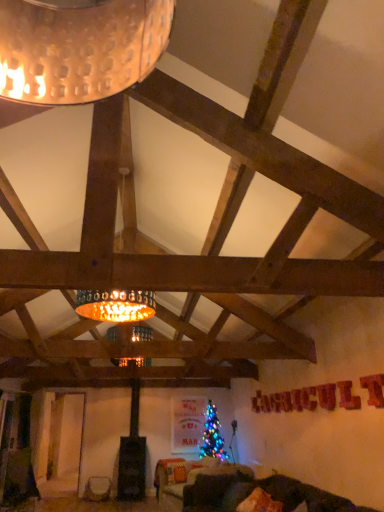
Find the location of a particular element. This screenshot has height=512, width=384. velvet dark green couch at lower center is located at coordinates (264, 490).

The height and width of the screenshot is (512, 384). I want to click on velvet dark green couch at lower center, so click(264, 490).

Which of these two, velvet orange pillow at lower center or matte white vase at lower left, is bigger?

With larger size is matte white vase at lower left.

The width and height of the screenshot is (384, 512). Identify the location of furniture behind the velvet orange pillow at lower center. (97, 489).

Considering the sizes of velvet orange pillow at lower center and matte white vase at lower left in the image, is velvet orange pillow at lower center wider or thinner than matte white vase at lower left?

Clearly, velvet orange pillow at lower center has less width compared to matte white vase at lower left.

Between velvet orange pillow at lower center and matte white vase at lower left, which one has less height?

velvet orange pillow at lower center is shorter.

What's the angular difference between velvet orange pillow at lower center and velvet dark green couch at lower center's facing directions?

1.31 degrees.

Looking at this image, from a real-world perspective, between velvet orange pillow at lower center and velvet dark green couch at lower center, who is vertically higher?

In real-world perspective, velvet orange pillow at lower center is above.

I want to click on couch that is on the left side of velvet orange pillow at lower center, so click(x=264, y=490).

Which is correct: velvet orange pillow at lower center is inside velvet dark green couch at lower center, or outside of it?

velvet orange pillow at lower center is spatially positioned inside velvet dark green couch at lower center.

Does point (204, 480) appear closer or farther from the camera than point (250, 495)?

Point (204, 480) is farther from the camera than point (250, 495).

Between velvet dark green couch at lower center and velvet orange pillow at lower center, which one has larger size?

velvet dark green couch at lower center is bigger.

From a real-world perspective, is velvet dark green couch at lower center physically below velvet orange pillow at lower center?

Yes, from a real-world perspective, velvet dark green couch at lower center is under velvet orange pillow at lower center.

From the image's perspective, is velvet dark green couch at lower center located above or below matte white vase at lower left?

From the image's perspective, velvet dark green couch at lower center appears above matte white vase at lower left.

Is velvet dark green couch at lower center to the left or to the right of matte white vase at lower left in the image?

From the image, it's evident that velvet dark green couch at lower center is to the right of matte white vase at lower left.

How many degrees apart are the facing directions of velvet dark green couch at lower center and matte white vase at lower left?

89.8 degrees separate the facing orientations of velvet dark green couch at lower center and matte white vase at lower left.

Can you confirm if matte white vase at lower left is wider than velvet dark green couch at lower center?

In fact, matte white vase at lower left might be narrower than velvet dark green couch at lower center.

From a real-world perspective, between matte white vase at lower left and velvet dark green couch at lower center, who is vertically lower?

In real-world perspective, matte white vase at lower left is lower.

Considering the positions of point (98, 495) and point (245, 494), is point (98, 495) closer or farther from the camera than point (245, 494)?

Point (98, 495).

Can you confirm if matte white vase at lower left is taller than velvet dark green couch at lower center?

Incorrect, the height of matte white vase at lower left is not larger of that of velvet dark green couch at lower center.

In the scene shown: Do you think matte white vase at lower left is within velvet orange pillow at lower center, or outside of it?

matte white vase at lower left is outside velvet orange pillow at lower center.

In the scene shown: Considering the positions of objects matte white vase at lower left and velvet orange pillow at lower center in the image provided, who is more to the right, matte white vase at lower left or velvet orange pillow at lower center?

velvet orange pillow at lower center.

Is matte white vase at lower left bigger or smaller than velvet orange pillow at lower center?

Clearly, matte white vase at lower left is larger in size than velvet orange pillow at lower center.

Image resolution: width=384 pixels, height=512 pixels. Identify the location of pillow in front of the matte white vase at lower left. (259, 502).

This screenshot has width=384, height=512. In order to click on pillow above the velvet dark green couch at lower center (from the image's perspective) in this screenshot , I will do `click(259, 502)`.

Which object lies nearer to the anchor point velvet orange pillow at lower center, velvet dark green couch at lower center or matte white vase at lower left?

Based on the image, velvet dark green couch at lower center appears to be nearer to velvet orange pillow at lower center.

When comparing their distances from velvet dark green couch at lower center, does matte white vase at lower left or velvet orange pillow at lower center seem closer?

Based on the image, velvet orange pillow at lower center appears to be nearer to velvet dark green couch at lower center.

Looking at the image, which one is located closer to velvet dark green couch at lower center, velvet orange pillow at lower center or matte white vase at lower left?

velvet orange pillow at lower center is positioned closer to the anchor velvet dark green couch at lower center.

When comparing their distances from matte white vase at lower left, does velvet dark green couch at lower center or velvet orange pillow at lower center seem closer?

Based on the image, velvet dark green couch at lower center appears to be nearer to matte white vase at lower left.

Estimate the real-world distances between objects in this image. Which object is further from velvet orange pillow at lower center, matte white vase at lower left or velvet dark green couch at lower center?

Among the two, matte white vase at lower left is located further to velvet orange pillow at lower center.

Which object lies nearer to the anchor point matte white vase at lower left, velvet orange pillow at lower center or velvet dark green couch at lower center?

The object closer to matte white vase at lower left is velvet dark green couch at lower center.

Find the location of `pillow between velvet dark green couch at lower center and matte white vase at lower left in the front-back direction`. pillow between velvet dark green couch at lower center and matte white vase at lower left in the front-back direction is located at coordinates (259, 502).